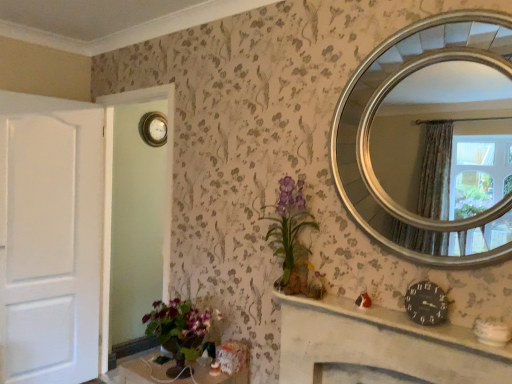
Question: Can you confirm if black clock at center is positioned to the left of gold metallic clock at upper left?

Choices:
 (A) no
 (B) yes

Answer: (A)

Question: Considering the relative sizes of black clock at center and gold metallic clock at upper left in the image provided, is black clock at center bigger than gold metallic clock at upper left?

Choices:
 (A) no
 (B) yes

Answer: (A)

Question: Is black clock at center wider than gold metallic clock at upper left?

Choices:
 (A) yes
 (B) no

Answer: (A)

Question: From the image's perspective, is black clock at center on top of gold metallic clock at upper left?

Choices:
 (A) no
 (B) yes

Answer: (A)

Question: Is black clock at center looking in the opposite direction of gold metallic clock at upper left?

Choices:
 (A) no
 (B) yes

Answer: (A)

Question: Considering their positions, is matte purple vase at center located in front of or behind gold metallic clock at upper left?

Choices:
 (A) behind
 (B) front

Answer: (B)

Question: Is point (285, 236) positioned closer to the camera than point (130, 153)?

Choices:
 (A) farther
 (B) closer

Answer: (B)

Question: From a real-world perspective, is matte purple vase at center positioned above or below gold metallic clock at upper left?

Choices:
 (A) above
 (B) below

Answer: (A)

Question: Looking at their shapes, would you say matte purple vase at center is wider or thinner than gold metallic clock at upper left?

Choices:
 (A) wide
 (B) thin

Answer: (A)

Question: Would you say silver/golden mirror at upper right is to the left or to the right of black clock at center in the picture?

Choices:
 (A) right
 (B) left

Answer: (A)

Question: From the image's perspective, relative to black clock at center, is silver/golden mirror at upper right above or below?

Choices:
 (A) above
 (B) below

Answer: (A)

Question: Is point (380, 120) positioned closer to the camera than point (292, 370)?

Choices:
 (A) farther
 (B) closer

Answer: (A)

Question: Considering the positions of silver/golden mirror at upper right and black clock at center in the image, is silver/golden mirror at upper right wider or thinner than black clock at center?

Choices:
 (A) wide
 (B) thin

Answer: (B)

Question: Do you think matte purple vase at center is within white matte door at left, or outside of it?

Choices:
 (A) outside
 (B) inside

Answer: (A)

Question: Is matte purple vase at center to the left or to the right of white matte door at left in the image?

Choices:
 (A) left
 (B) right

Answer: (B)